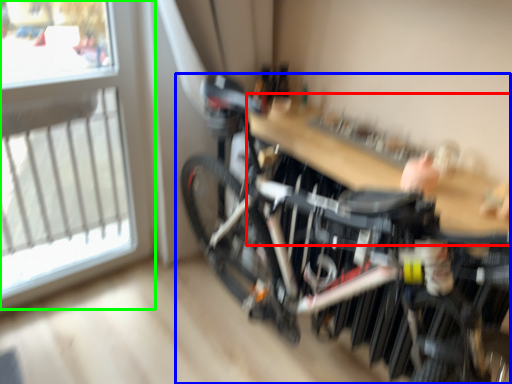
Question: Which is nearer to the table (highlighted by a red box)? bicycle (highlighted by a blue box) or window (highlighted by a green box).

Choices:
 (A) bicycle
 (B) window

Answer: (A)